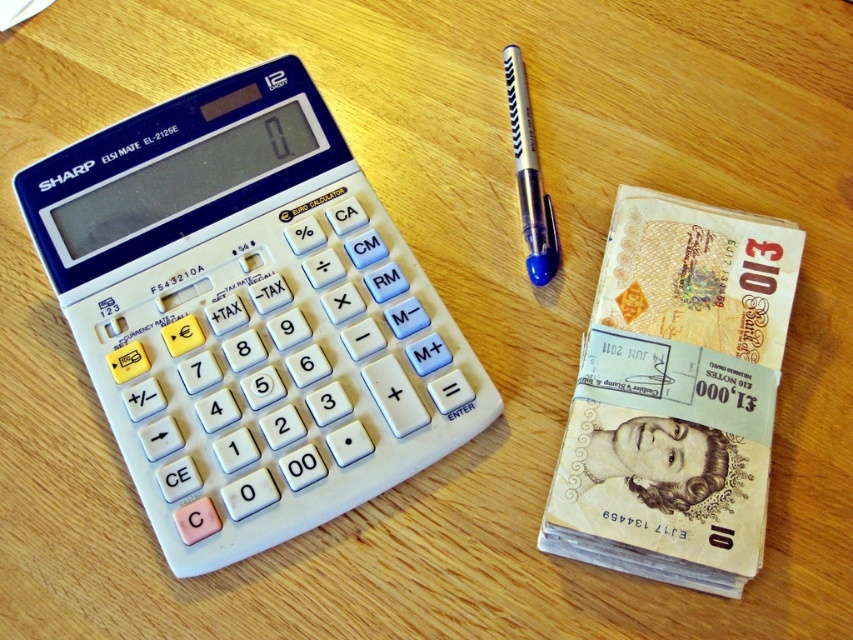
Who is more distant from viewer, [131,406] or [763,374]?

Positioned behind is point [131,406].

Is white plastic calculator at left smaller than light brown paper money at right?

Actually, white plastic calculator at left might be larger than light brown paper money at right.

Is point (281, 278) positioned before point (706, 465)?

That is False.

Image resolution: width=853 pixels, height=640 pixels. I want to click on white plastic calculator at left, so click(248, 316).

Can you confirm if white plastic calculator at left is positioned above metallic silver pen at center-right?

Actually, white plastic calculator at left is below metallic silver pen at center-right.

Which is more to the right, white plastic calculator at left or metallic silver pen at center-right?

Positioned to the right is metallic silver pen at center-right.

Describe the element at coordinates (248, 316) in the screenshot. I see `white plastic calculator at left` at that location.

Locate an element on the screen. This screenshot has height=640, width=853. white plastic calculator at left is located at coordinates (248, 316).

Looking at this image, can you confirm if light brown paper money at right is smaller than metallic silver pen at center-right?

No, light brown paper money at right is not smaller than metallic silver pen at center-right.

Can you confirm if light brown paper money at right is positioned to the right of metallic silver pen at center-right?

Indeed, light brown paper money at right is positioned on the right side of metallic silver pen at center-right.

Between point (711, 545) and point (509, 86), which one is positioned behind?

The point (509, 86) is behind.

Where is `light brown paper money at right`? light brown paper money at right is located at coordinates (676, 396).